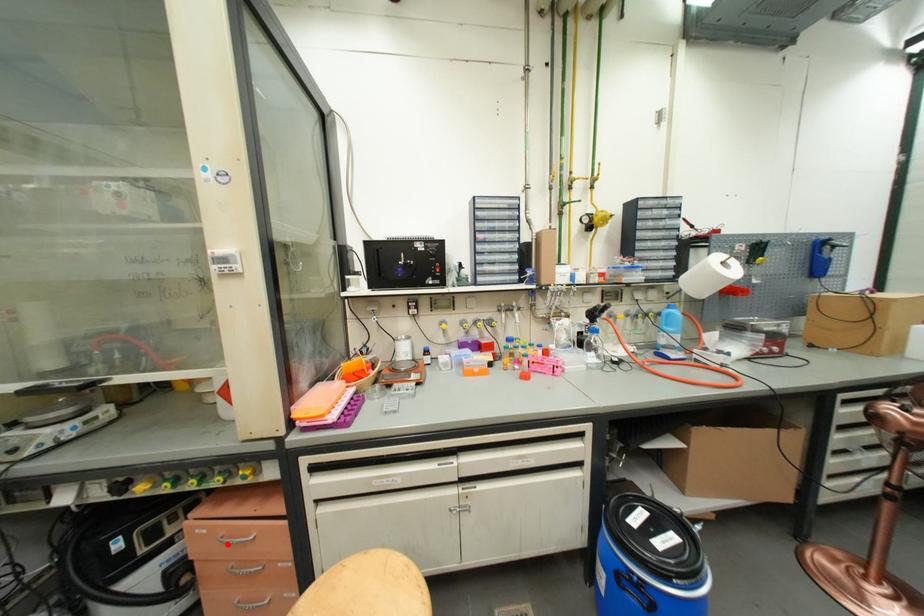
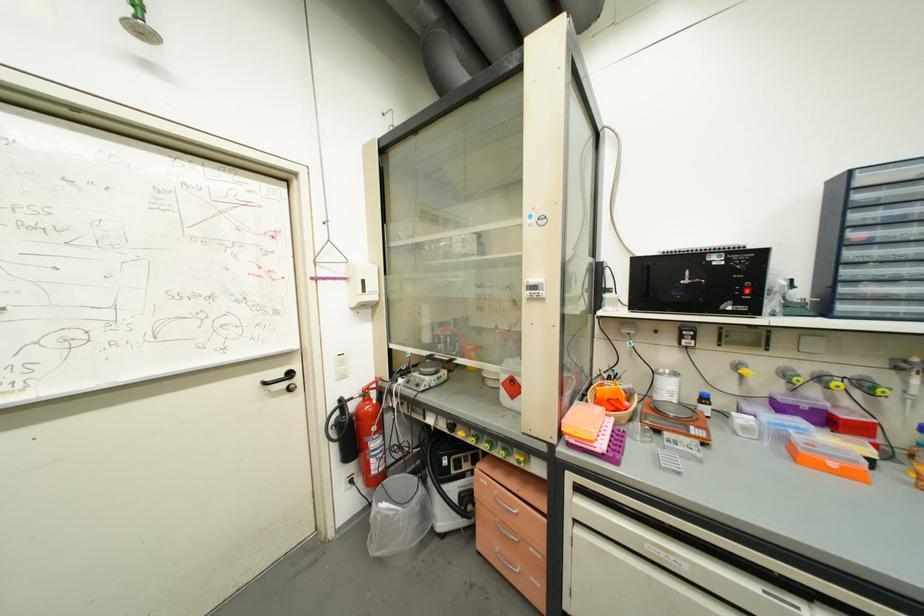
Locate, in the second image, the point that corresponds to the highlighted location in the first image.

(502, 503)